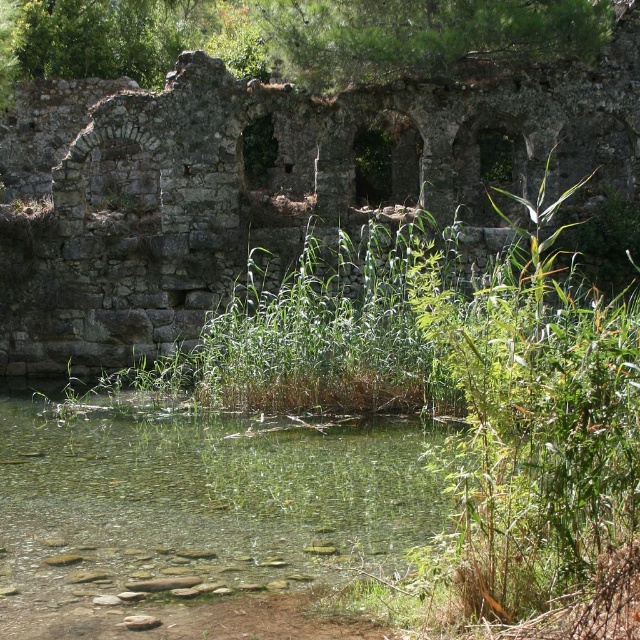
Measure the distance between clear water at center and green leafy tree at upper center.

clear water at center and green leafy tree at upper center are 18.46 meters apart.

Does clear water at center have a lesser width compared to green leafy tree at upper center?

Yes, clear water at center is thinner than green leafy tree at upper center.

This screenshot has height=640, width=640. Describe the element at coordinates (196, 518) in the screenshot. I see `clear water at center` at that location.

Locate an element on the screen. clear water at center is located at coordinates (196, 518).

Is rusty stone ruins at center behind clear water at center?

Yes.

Image resolution: width=640 pixels, height=640 pixels. Describe the element at coordinates (253, 188) in the screenshot. I see `rusty stone ruins at center` at that location.

What are the coordinates of `rusty stone ruins at center` in the screenshot? It's located at (253, 188).

At what (x,y) coordinates should I click in order to perform the action: click on rusty stone ruins at center. Please return your answer as a coordinate pair (x, y). Looking at the image, I should click on (253, 188).

Which of these two, rusty stone ruins at center or green leafy tree at upper center, stands shorter?

With less height is green leafy tree at upper center.

Is point (124, 266) closer to viewer compared to point (488, 13)?

No, it is not.

Find the location of a particular element. The width and height of the screenshot is (640, 640). rusty stone ruins at center is located at coordinates (253, 188).